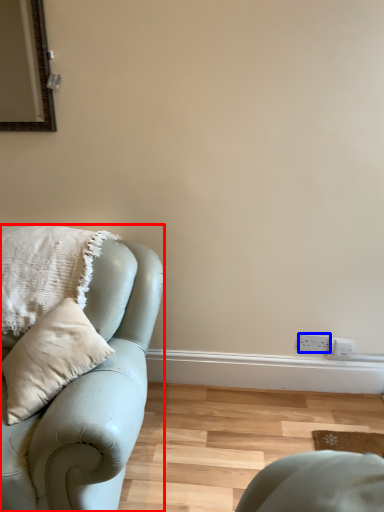
Question: Which object is further to the camera taking this photo, studio couch (highlighted by a red box) or electric outlet (highlighted by a blue box)?

Choices:
 (A) studio couch
 (B) electric outlet

Answer: (B)